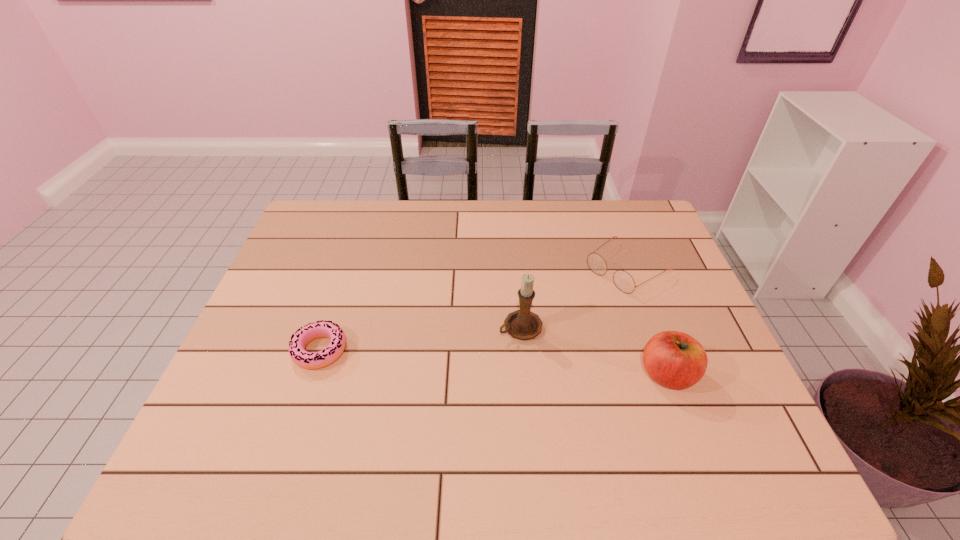
Image resolution: width=960 pixels, height=540 pixels. What are the coordinates of `free space on the desktop that is between the doughnut and the apple and is positioned on the temples of the farthest object` in the screenshot? It's located at (490, 362).

You are a GUI agent. You are given a task and a screenshot of the screen. Output one action in this format:
    pyautogui.click(x=<x>, y=<y>)
    Task: Click on the vacant space on the desktop that is between the leftmost object and the second tallest object and is positioned on the side of the tallest object with the handle
    The image size is (960, 540).
    Given the screenshot: What is the action you would take?
    pyautogui.click(x=447, y=359)